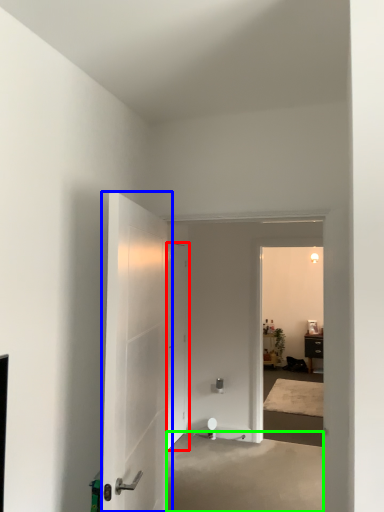
Question: Which object is positioned farthest from door (highlighted by a red box)? Select from door (highlighted by a blue box) and concrete (highlighted by a green box).

Choices:
 (A) door
 (B) concrete

Answer: (A)